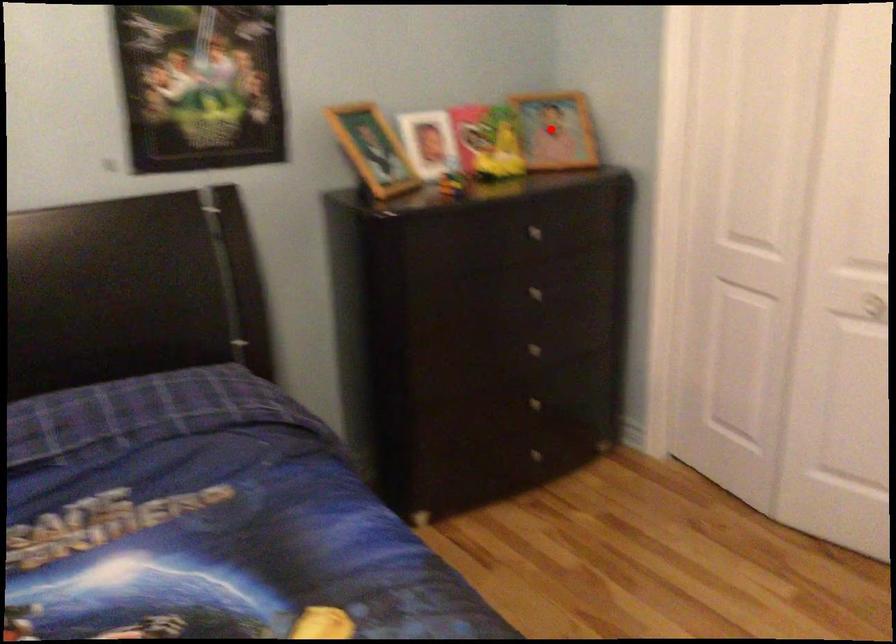
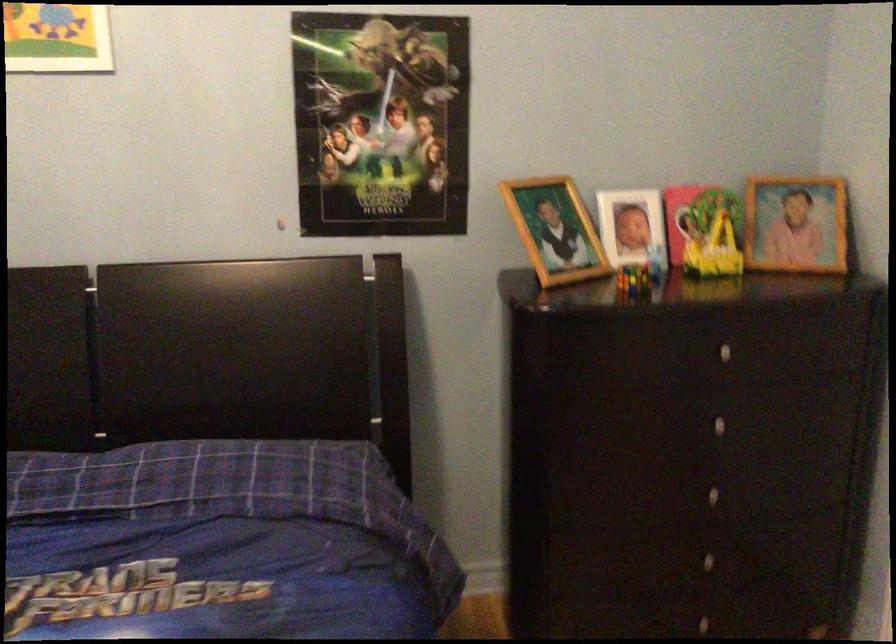
Question: I am providing you with two images of the same scene from different viewpoints. A red point is shown in image1. For the corresponding object point in image2, is it positioned nearer or farther from the camera?

Choices:
 (A) Nearer
 (B) Farther

Answer: (A)